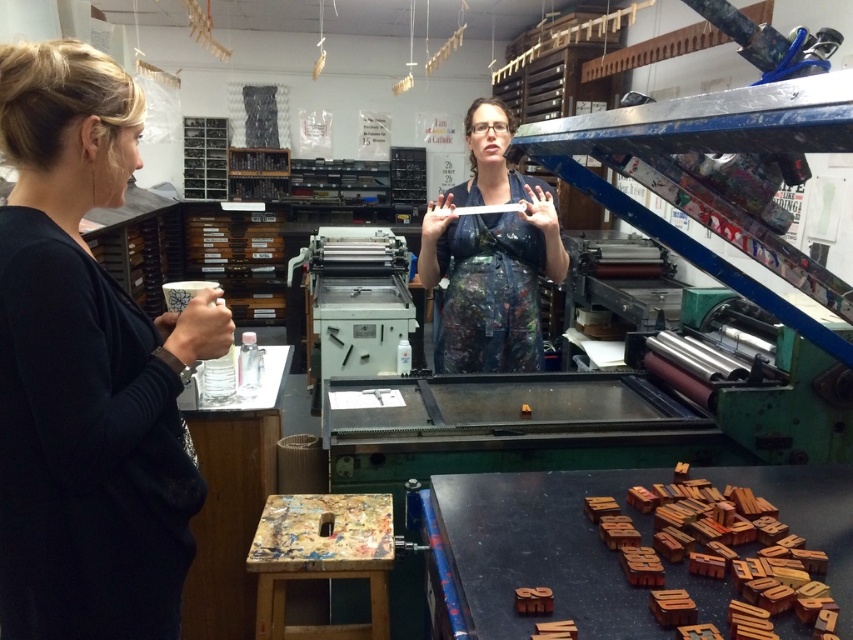
Who is taller, black fabric shirt at left or matte black apron at center?

Standing taller between the two is black fabric shirt at left.

Is point (221, 339) more distant than point (468, 321)?

No, it is not.

Which is behind, point (178, 634) or point (476, 276)?

The point (476, 276) is behind.

Locate an element on the screen. This screenshot has height=640, width=853. black fabric shirt at left is located at coordinates (86, 371).